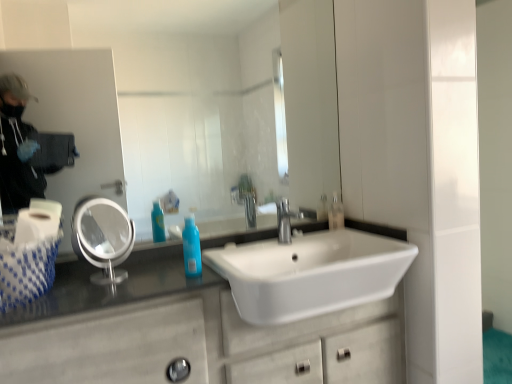
In order to click on free point behind silver metallic faucet at center in this screenshot , I will do `click(298, 234)`.